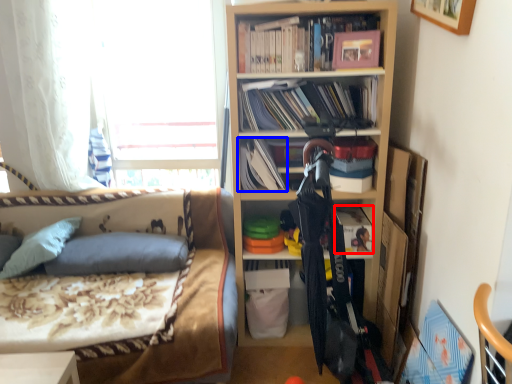
Question: Which of the following is the closest to the observer, book (highlighted by a red box) or book (highlighted by a blue box)?

Choices:
 (A) book
 (B) book

Answer: (B)